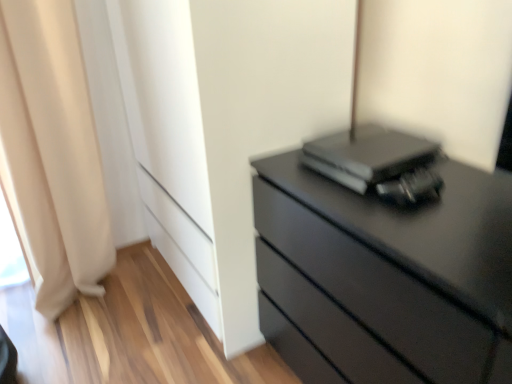
Where is `vacant space in beige fabric curtain at left (from a real-world perspective)`? This screenshot has width=512, height=384. vacant space in beige fabric curtain at left (from a real-world perspective) is located at coordinates (113, 283).